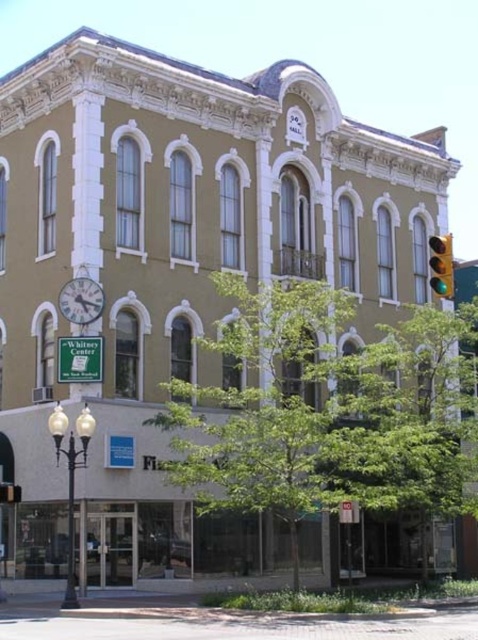
Question: Does metallic silver clock at upper left have a larger size compared to green glass traffic light at right?

Choices:
 (A) no
 (B) yes

Answer: (A)

Question: Which object appears farthest from the camera in this image?

Choices:
 (A) green glass traffic light at right
 (B) metallic silver clock at upper left

Answer: (B)

Question: Can you confirm if metallic silver clock at upper left is wider than green glass traffic light at right?

Choices:
 (A) yes
 (B) no

Answer: (B)

Question: Is metallic silver clock at upper left thinner than green glass traffic light at right?

Choices:
 (A) yes
 (B) no

Answer: (A)

Question: Which point appears farthest from the camera in this image?

Choices:
 (A) (73, 280)
 (B) (435, 252)

Answer: (A)

Question: Among these points, which one is nearest to the camera?

Choices:
 (A) (65, 307)
 (B) (449, 262)

Answer: (B)